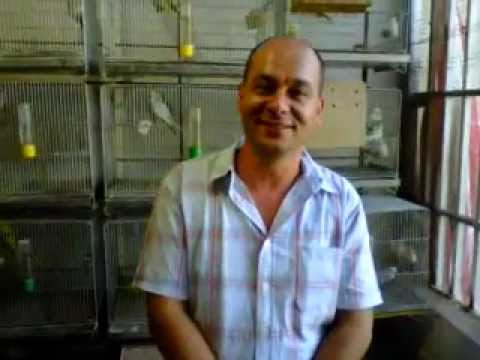
Locate an element on the screen. Image resolution: width=480 pixels, height=360 pixels. yellow water dispenser is located at coordinates (32, 153).